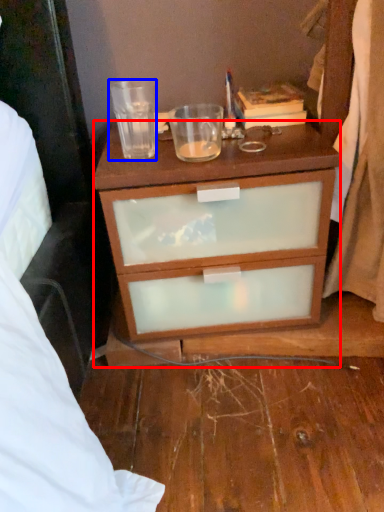
Question: Which point is further to the camera, desk (highlighted by a red box) or coffee cup (highlighted by a blue box)?

Choices:
 (A) desk
 (B) coffee cup

Answer: (B)